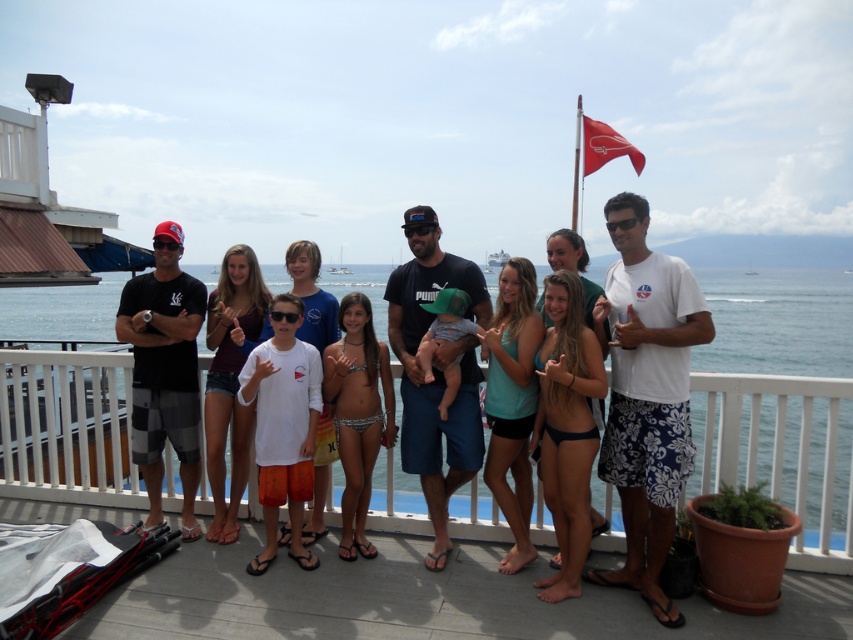
Does smooth wooden deck at lower center have a greater height compared to red fabric flag at upper center?

Incorrect, smooth wooden deck at lower center's height is not larger of red fabric flag at upper center's.

Does smooth wooden deck at lower center have a lesser height compared to red fabric flag at upper center?

Yes.

Does point (496, 620) come in front of point (619, 145)?

Yes, point (496, 620) is closer to viewer.

Where is `smooth wooden deck at lower center`? smooth wooden deck at lower center is located at coordinates (418, 600).

Is the position of white printed bikini at center less distant than that of maroon jersey at center?

Yes.

Who is shorter, white printed bikini at center or maroon jersey at center?

With less height is white printed bikini at center.

The width and height of the screenshot is (853, 640). Describe the element at coordinates (357, 413) in the screenshot. I see `white printed bikini at center` at that location.

Find the location of `white printed bikini at center`. white printed bikini at center is located at coordinates (357, 413).

Between white matte shirt at center and red fabric flag at upper center, which one appears on the right side from the viewer's perspective?

red fabric flag at upper center

Is white matte shirt at center bigger than red fabric flag at upper center?

No, white matte shirt at center is not bigger than red fabric flag at upper center.

Locate an element on the screen. Image resolution: width=853 pixels, height=640 pixels. white matte shirt at center is located at coordinates (283, 424).

Identify the location of white matte shirt at center. This screenshot has height=640, width=853. (283, 424).